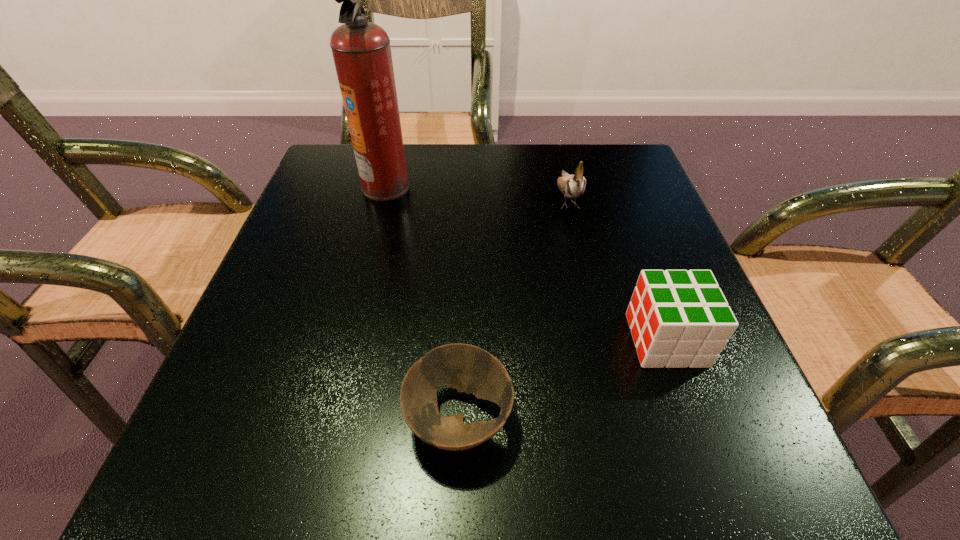
The height and width of the screenshot is (540, 960). I want to click on object that can be found as the second closest to the third object from left to right, so click(361, 50).

Locate an element on the screen. vacant space that satisfies the following two spatial constraints: 1. at the nozzle of the fire extinguisher; 2. on the back side of the bowl is located at coordinates tap(326, 418).

At what (x,y) coordinates should I click in order to perform the action: click on free spot that satisfies the following two spatial constraints: 1. at the nozzle of the third object from right to left; 2. on the left side of the leftmost object. Please return your answer as a coordinate pair (x, y). Looking at the image, I should click on (326, 418).

Identify the location of free location that satisfies the following two spatial constraints: 1. at the nozzle of the tallest object; 2. on the right side of the nearest object. (326, 418).

Locate an element on the screen. This screenshot has height=540, width=960. free space that satisfies the following two spatial constraints: 1. on the red face of the rightmost object; 2. on the front side of the shortest object is located at coordinates (694, 418).

The image size is (960, 540). What are the coordinates of `vacant area in the image that satisfies the following two spatial constraints: 1. on the red face of the third tallest object; 2. on the front side of the shortest object` in the screenshot? It's located at pyautogui.click(x=694, y=418).